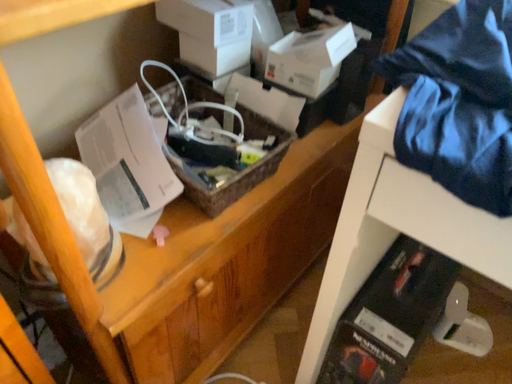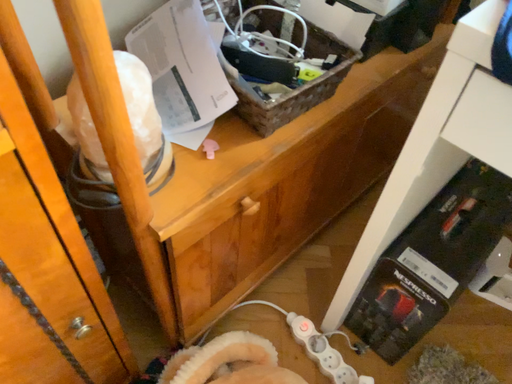
Question: How did the camera likely rotate when shooting the video?

Choices:
 (A) rotated downward
 (B) rotated upward

Answer: (A)